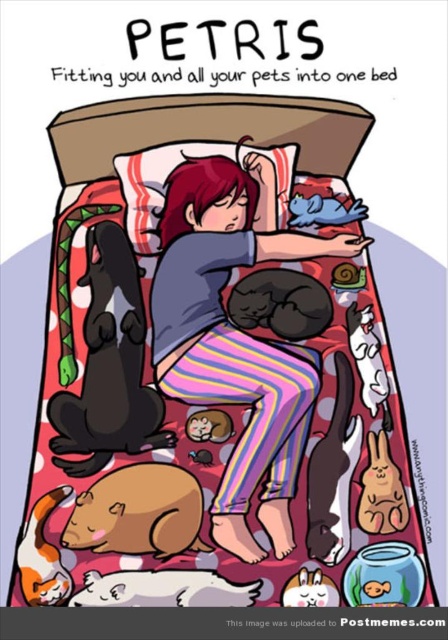
Question: Which object is positioned farthest from the black fur dog at lower left?

Choices:
 (A) matte blue shirt at center
 (B) brown furry hamster at lower left
 (C) white soft pillow at upper center
 (D) white fur cat at lower left

Answer: (D)

Question: Is brown furry hamster at lower left smaller than white fur cat at lower left?

Choices:
 (A) yes
 (B) no

Answer: (B)

Question: From the image, what is the correct spatial relationship of brown furry hamster at lower left in relation to white soft pillow at upper center?

Choices:
 (A) above
 (B) below

Answer: (B)

Question: Which point appears farthest from the camera in this image?

Choices:
 (A) (266, 388)
 (B) (176, 509)

Answer: (A)

Question: Does brown furry hamster at lower left appear over white soft pillow at upper center?

Choices:
 (A) no
 (B) yes

Answer: (A)

Question: Which object is positioned closest to the white soft pillow at upper center?

Choices:
 (A) black fur dog at lower left
 (B) brown furry hamster at lower left
 (C) white fur cat at lower left

Answer: (A)